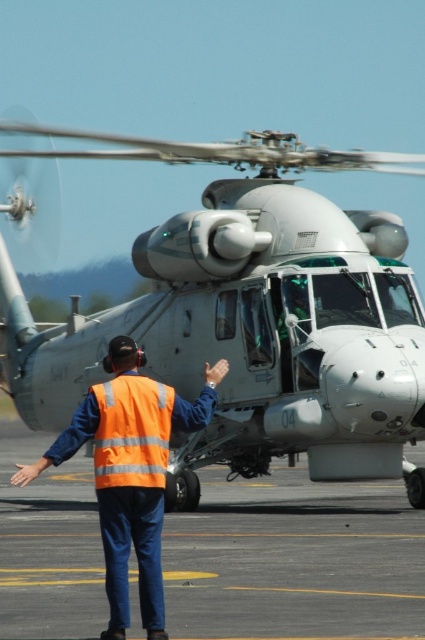
What is located at the point with coordinates (294, 561) in the image?

The gray asphalt tarmac at center is located at point (294, 561).

You are a pilot preparing to land your helicopter on the gray asphalt tarmac at center. You notice the orange reflective safety vest at center is in your landing path. Based on the scene description, can you safely land on the tarmac without hitting the vest?

The gray asphalt tarmac at center is much taller than the orange reflective safety vest at center, so the vest is likely positioned below the landing zone. Therefore, it should be safe to land on the gray asphalt tarmac at center without hitting the vest.

You are a pilot preparing to land a helicopter that requires a minimum of 20 meters of clear runway space. You observe the gray asphalt tarmac at center and the orange reflective safety vest at center in the scene. Is there enough space between them to safely land?

The distance between the gray asphalt tarmac at center and the orange reflective safety vest at center is 22.59 meters, which exceeds the required 20 meters. Therefore, there is sufficient space to safely land.